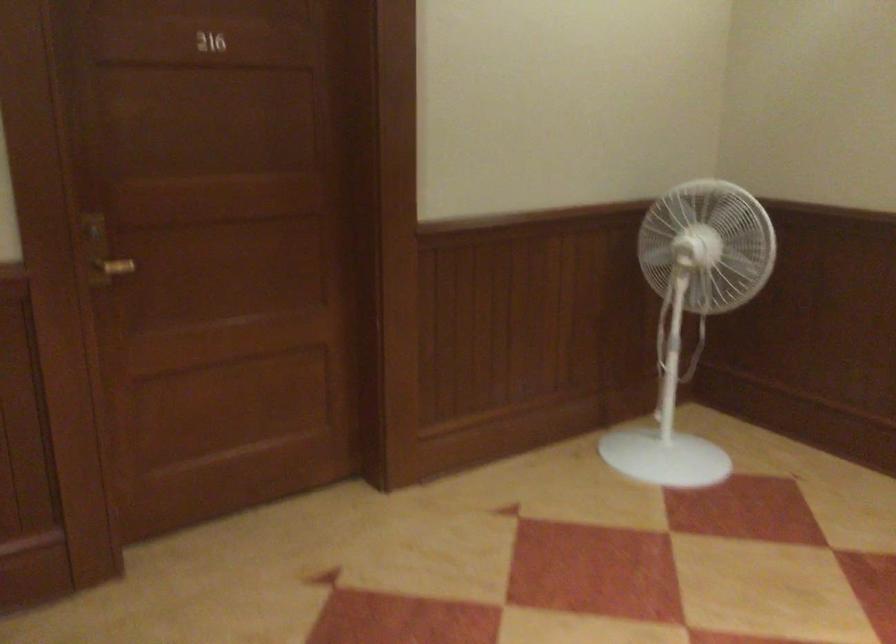
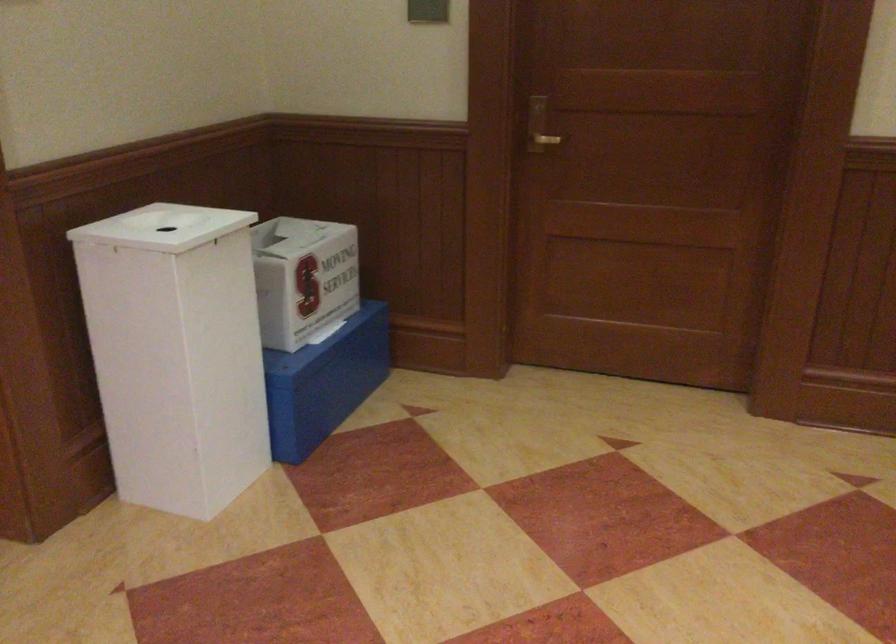
Find the pixel in the second image that matches point 104,257 in the first image.

(538, 126)